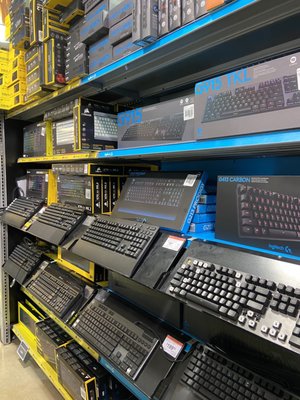
You are a GUI agent. You are given a task and a screenshot of the screen. Output one action in this format:
    pyautogui.click(x=<x>, y=<y>)
    Task: Click on the reflected light on silver gray keyboard
    
    Given the screenshot: What is the action you would take?
    pyautogui.click(x=290, y=269)